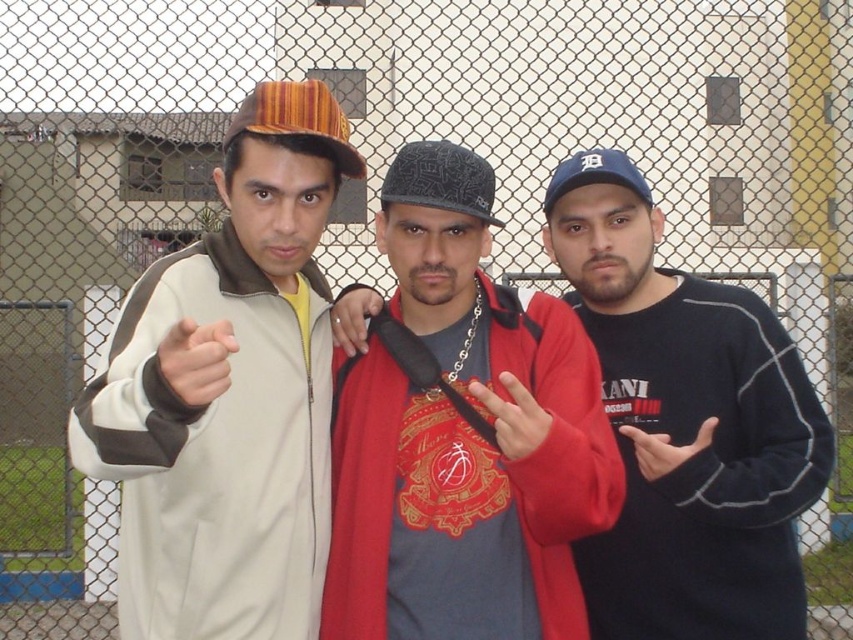
You are a photographer trying to capture the scene. You notice two elements in the image, the patterned fabric baseball cap at center and the matte red hand at center. Based on their positions, which one is closer to the left side of the photo?

The patterned fabric baseball cap at center is to the left of the matte red hand at center, so it is closer to the left side of the photo.

What is the color of the fabric at the point with coordinates (x=299, y=120)?

The point at coordinates (x=299, y=120) is on the striped fabric baseball cap at left, which has orange and brown tones.

You are a photographer trying to capture a closeup of the striped fabric baseball cap at left and the matte skin hand at center. Which object should you zoom in on to ensure both are in focus without moving the camera?

The striped fabric baseball cap at left is larger in size compared to the matte skin hand at center, so you should focus on the striped fabric baseball cap at left to ensure both are in focus without moving the camera.